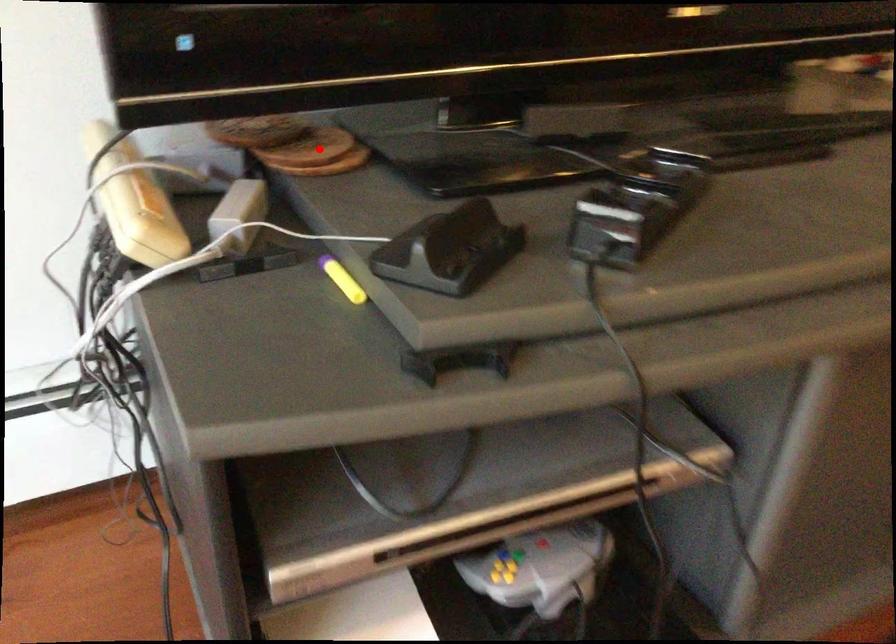
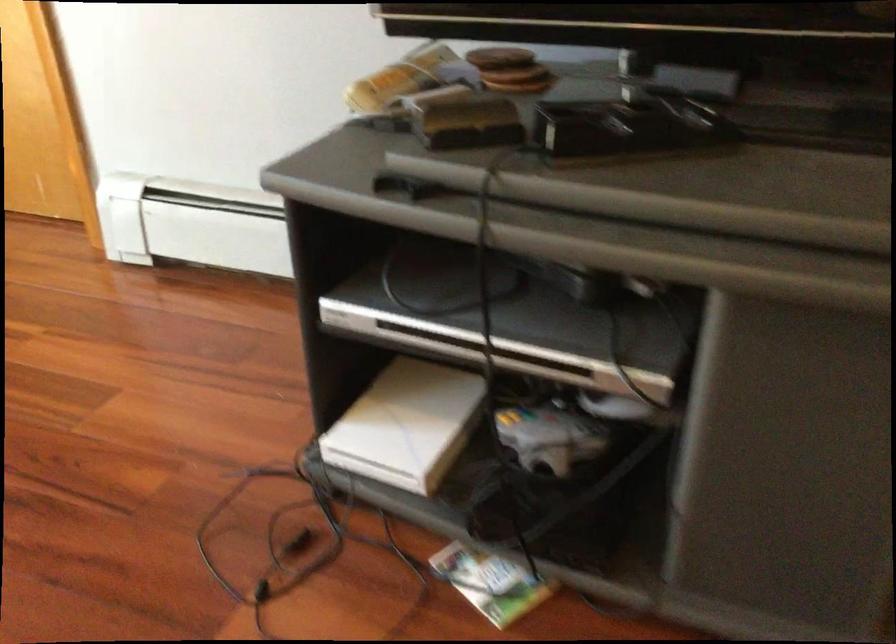
Question: I am providing you with two images of the same scene from different viewpoints. In image1, a red point is highlighted. Considering the same 3D point in image2, which of the following is correct?

Choices:
 (A) It is closer
 (B) It is farther

Answer: (B)